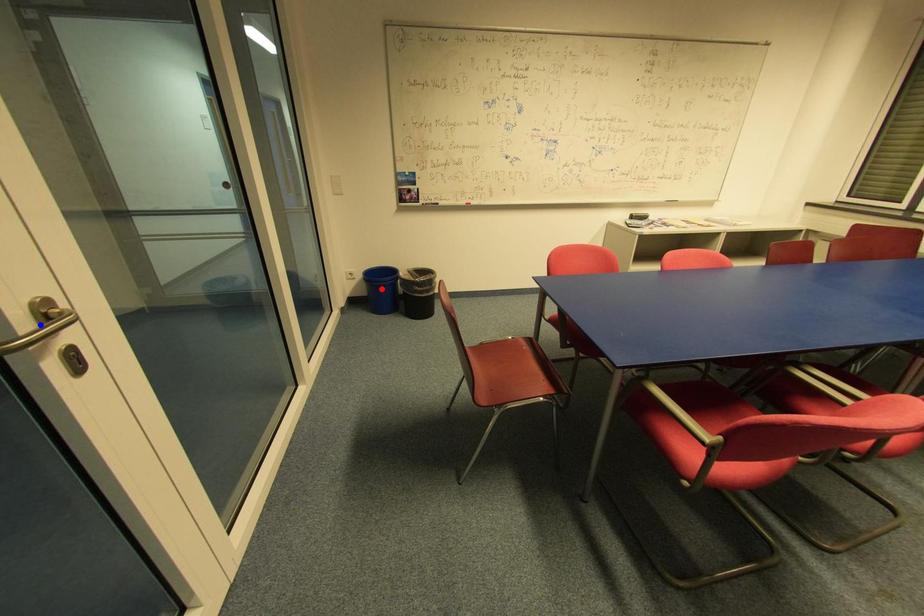
Question: Which of the two points in the image is closer to the camera?

Choices:
 (A) Blue point is closer.
 (B) Red point is closer.

Answer: (A)